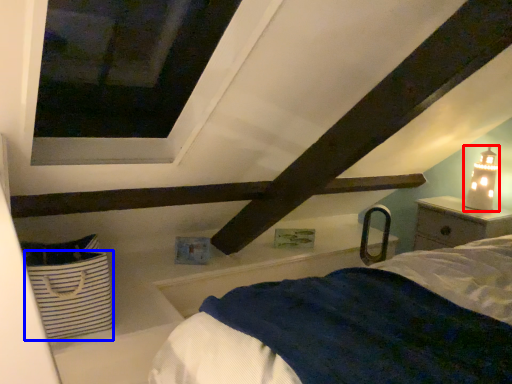
Question: Which of the following is the closest to the observer, table lamp (highlighted by a red box) or basket (highlighted by a blue box)?

Choices:
 (A) table lamp
 (B) basket

Answer: (B)